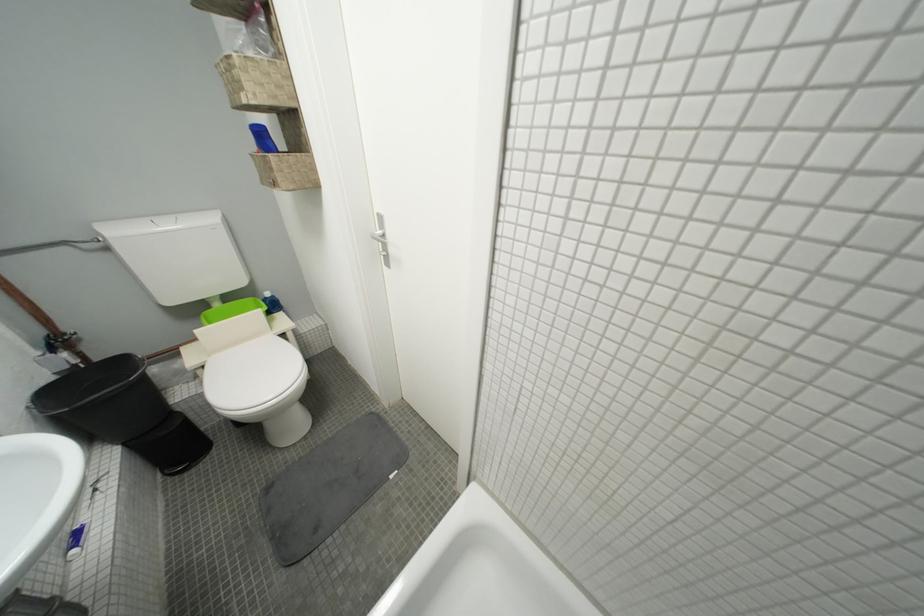
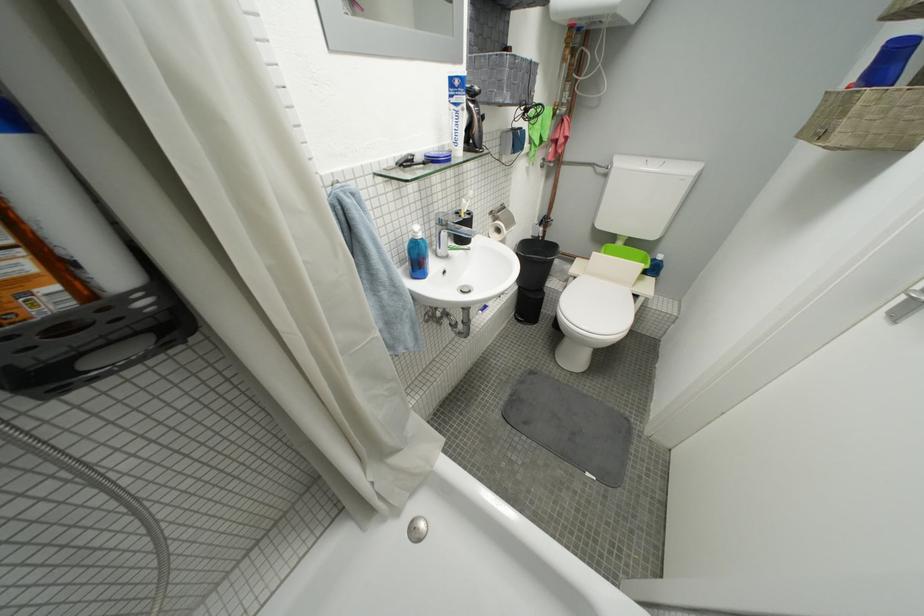
Locate, in the second image, the point that corresponds to point 178,482 in the first image.

(523, 322)